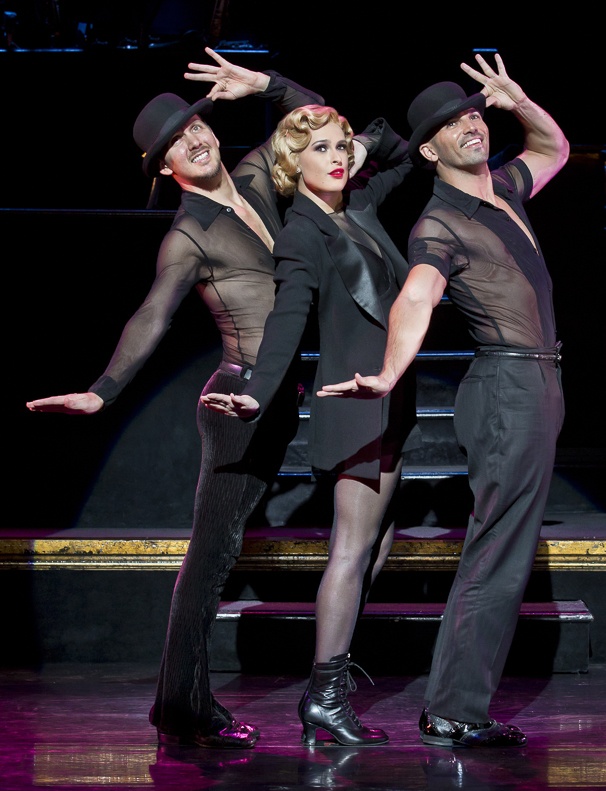
The width and height of the screenshot is (606, 791). Identify the location of floor. (128, 755).